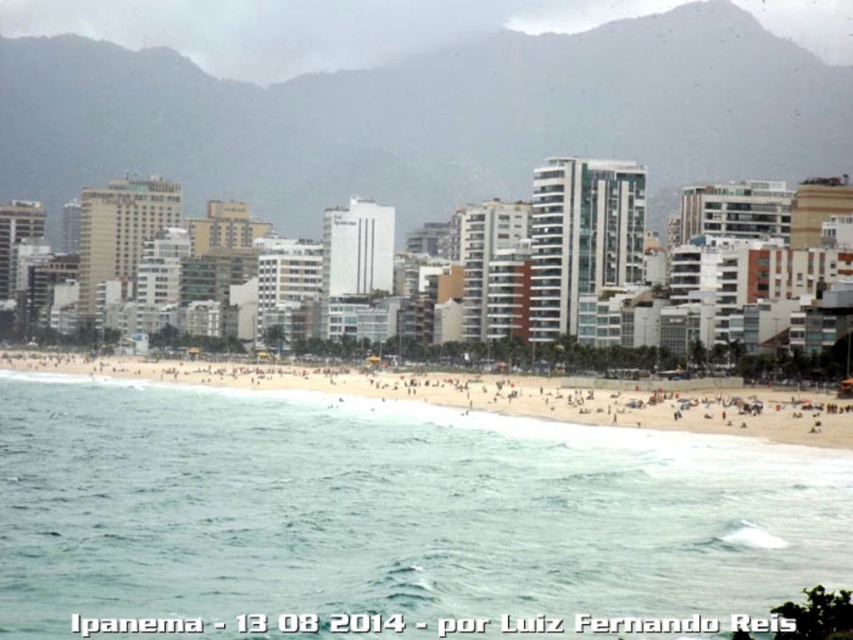
Question: Does clear blue water at lower center appear over golden sand beach at center?

Choices:
 (A) yes
 (B) no

Answer: (B)

Question: Is clear blue water at lower center below golden sand beach at center?

Choices:
 (A) yes
 (B) no

Answer: (A)

Question: Does clear blue water at lower center lie behind golden sand beach at center?

Choices:
 (A) yes
 (B) no

Answer: (B)

Question: Which object appears closest to the camera in this image?

Choices:
 (A) golden sand beach at center
 (B) clear blue water at lower center

Answer: (B)